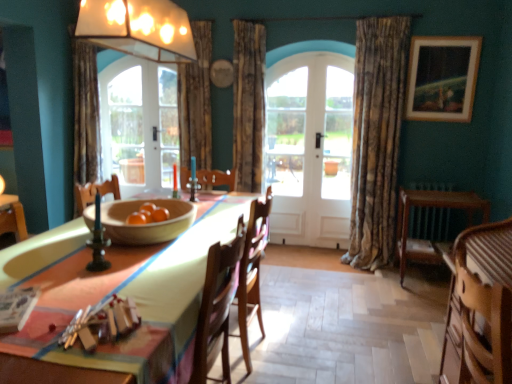
The width and height of the screenshot is (512, 384). I want to click on blank space situated above wooden framed painting at upper right (from a real-world perspective), so [x=440, y=36].